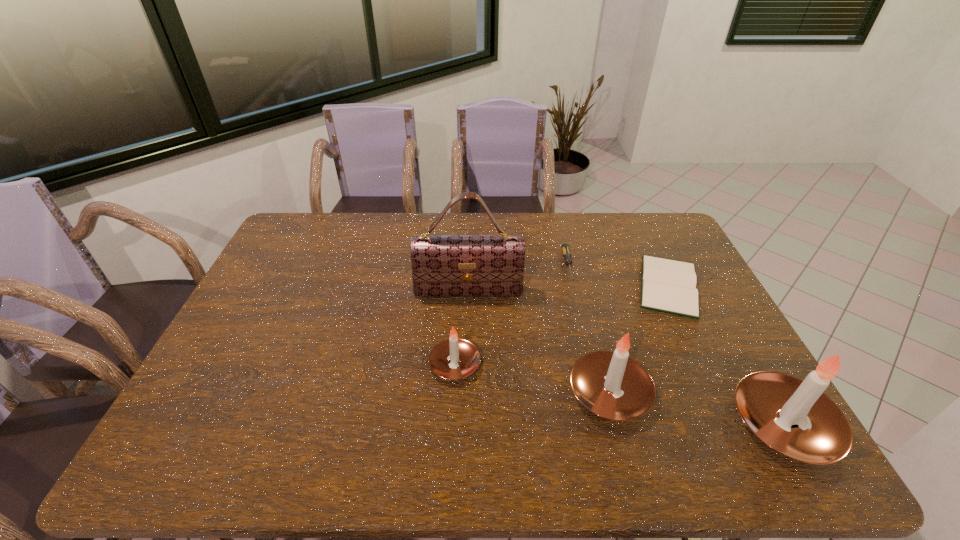
Where is `free space for a new candle on the left`? The width and height of the screenshot is (960, 540). free space for a new candle on the left is located at coordinates (318, 339).